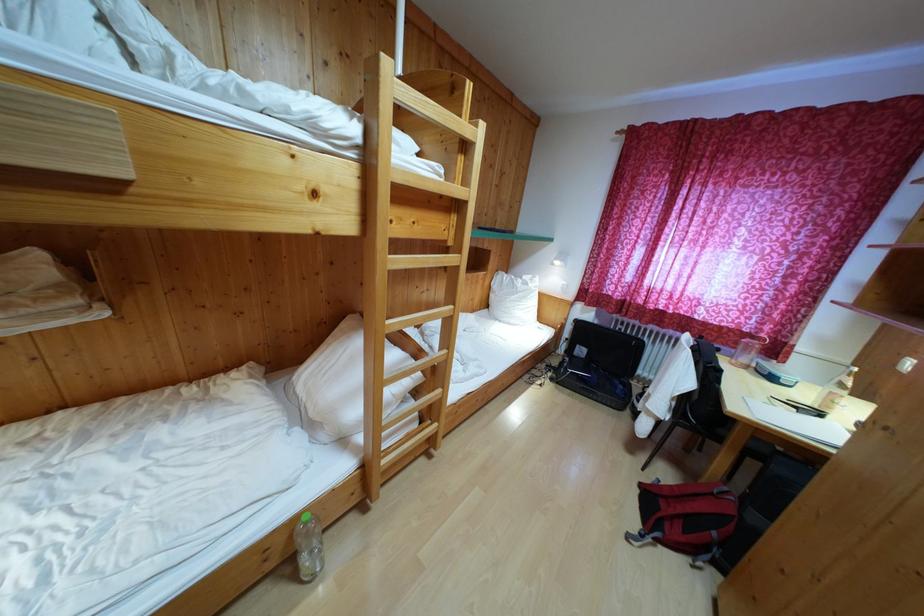
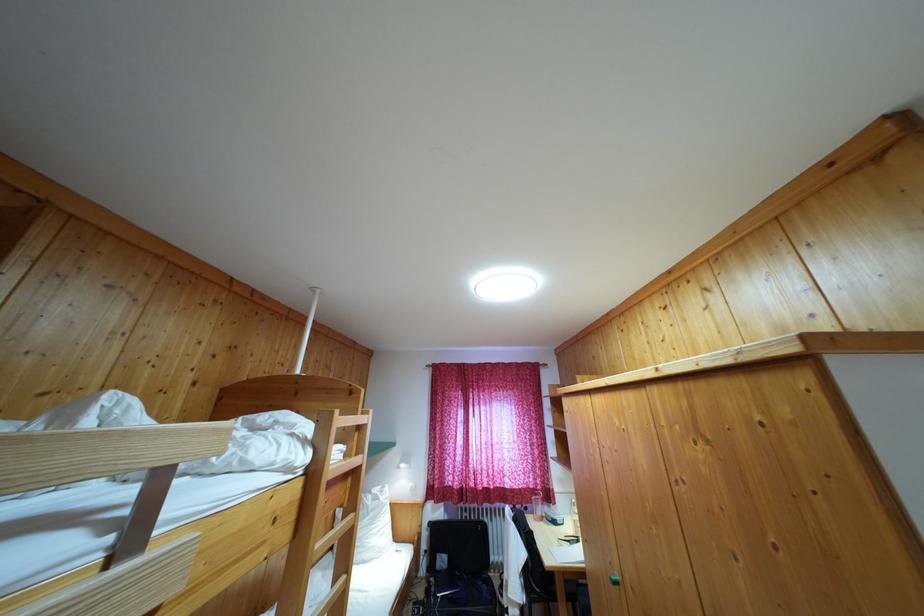
Where in the second image is the point corresponding to point 371,166 from the first image?

(317, 479)